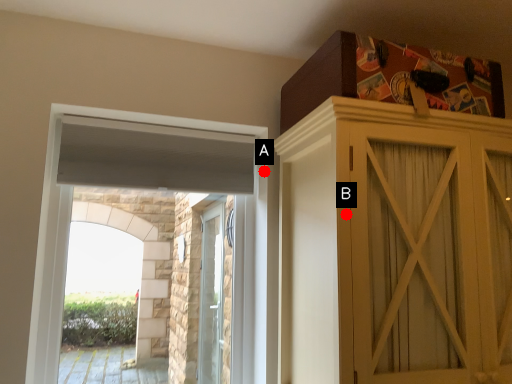
Question: Two points are circled on the image, labeled by A and B beside each circle. Which point appears farthest from the camera in this image?

Choices:
 (A) A is further
 (B) B is further

Answer: (A)